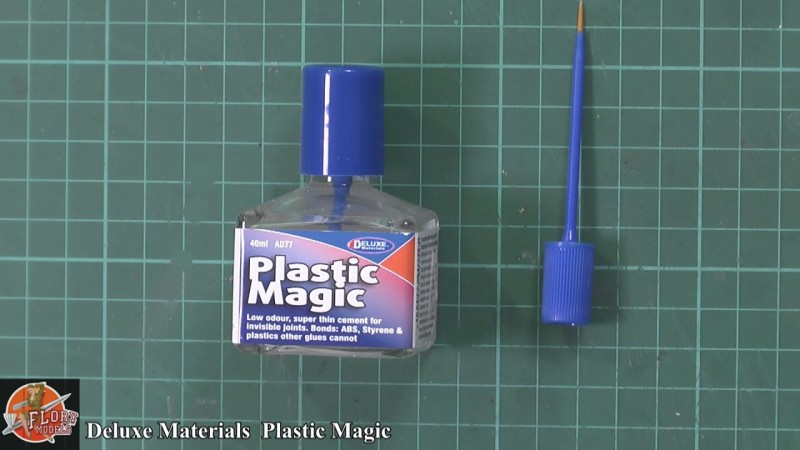
Identify the location of tile background. This screenshot has height=450, width=800. 106,291.